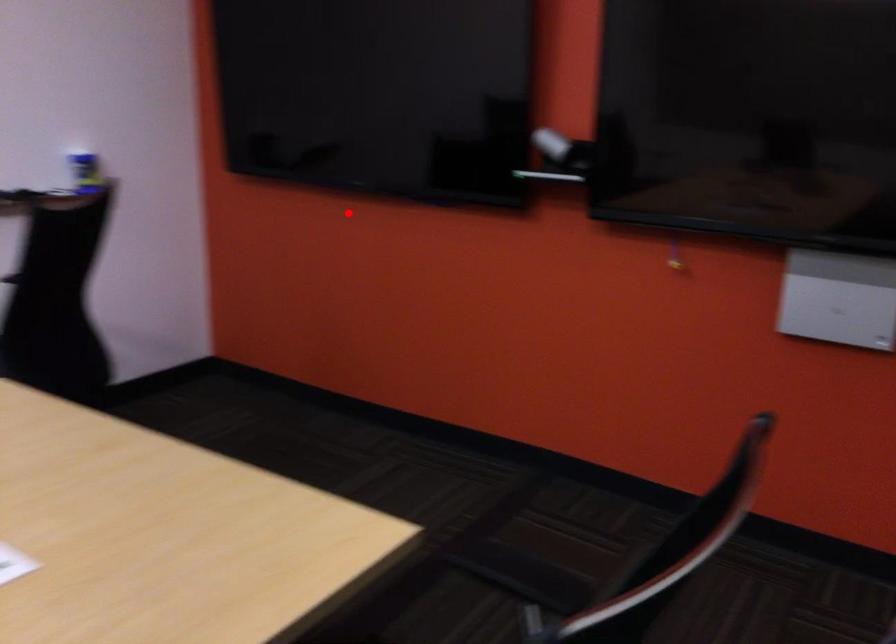
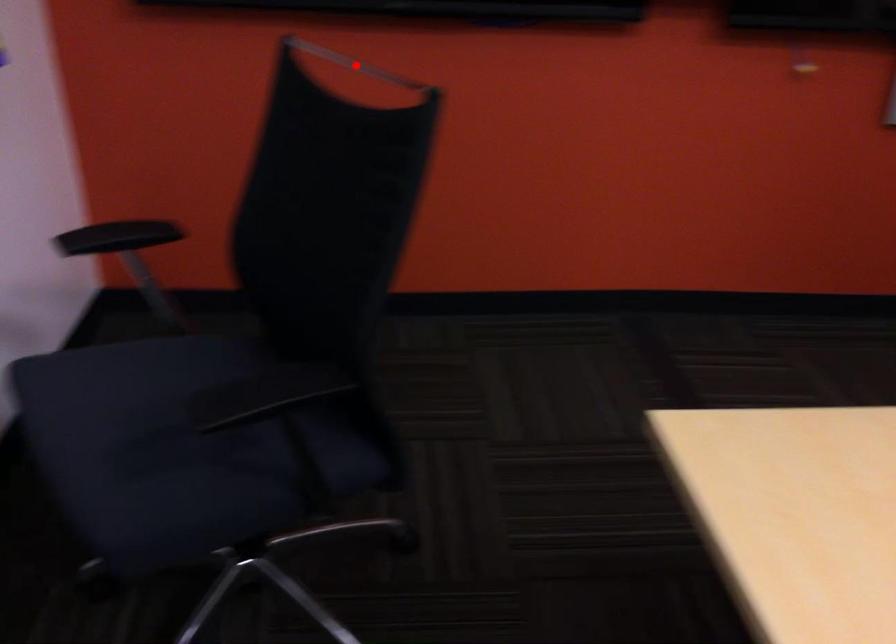
Consider the image. I am providing you with two images of the same scene from different viewpoints. A red point is marked on the first image and another point is marked on the second image. Are the points marked in image1 and image2 representing the same 3D position?

Yes